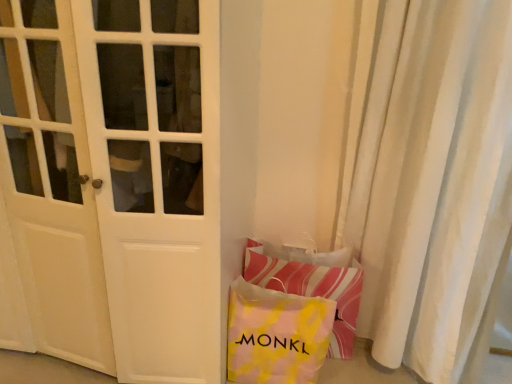
Question: Is white textured curtain at right situated inside white matte door at center or outside?

Choices:
 (A) inside
 (B) outside

Answer: (B)

Question: Does point (406, 231) appear closer or farther from the camera than point (72, 336)?

Choices:
 (A) farther
 (B) closer

Answer: (B)

Question: Which of these objects is positioned closest to the striped fabric pillow at lower right?

Choices:
 (A) yellow tie-dye fabric bag at lower right
 (B) white matte door at center
 (C) white textured curtain at right

Answer: (A)

Question: Which object is the closest to the white matte door at center?

Choices:
 (A) striped fabric pillow at lower right
 (B) yellow tie-dye fabric bag at lower right
 (C) white textured curtain at right

Answer: (B)